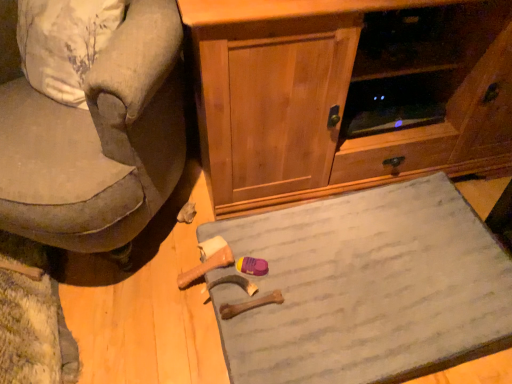
What is the approximate height of velvet gray armchair at left?

velvet gray armchair at left is 29.27 inches in height.

At what (x,y) coordinates should I click in order to perform the action: click on wooden cabinet at center. Please return your answer as a coordinate pair (x, y). Looking at the image, I should click on (348, 94).

Is wooden cabinet at center next to velvet gray armchair at left?

No, wooden cabinet at center is not touching velvet gray armchair at left.

Between point (426, 57) and point (167, 178), which one is positioned behind?

Point (426, 57)

Consider the image. Who is bigger, wooden cabinet at center or velvet gray armchair at left?

wooden cabinet at center.

Find the location of a particular element. This screenshot has width=512, height=384. chair on the left of wooden cabinet at center is located at coordinates click(x=92, y=123).

This screenshot has width=512, height=384. Find the location of `chair lying above the gray fabric doormat at lower center (from the image's perspective)`. chair lying above the gray fabric doormat at lower center (from the image's perspective) is located at coordinates (92, 123).

From the image's perspective, would you say gray fabric doormat at lower center is shown under velvet gray armchair at left?

Yes.

Is gray fabric doormat at lower center placed right next to velvet gray armchair at left?

They are not placed beside each other.

Does velvet gray armchair at left have a lesser width compared to wooden cabinet at center?

Yes.

Is velvet gray armchair at left behind wooden cabinet at center?

No.

How different are the orientations of velvet gray armchair at left and wooden cabinet at center in degrees?

The angle between the facing direction of velvet gray armchair at left and the facing direction of wooden cabinet at center is 54.2 degrees.

Are velvet gray armchair at left and wooden cabinet at center far apart?

No, velvet gray armchair at left is not far away from wooden cabinet at center.

Which of these two, gray fabric doormat at lower center or wooden cabinet at center, is smaller?

With smaller size is gray fabric doormat at lower center.

Considering the relative positions of gray fabric doormat at lower center and wooden cabinet at center in the image provided, is gray fabric doormat at lower center to the left or to the right of wooden cabinet at center?

Based on their positions, gray fabric doormat at lower center is located to the left of wooden cabinet at center.

Is point (441, 224) farther from camera compared to point (307, 190)?

That is False.

Consider the image. Is wooden cabinet at center surrounded by gray fabric doormat at lower center?

Definitely not — wooden cabinet at center is not inside gray fabric doormat at lower center.

In the scene shown: Is wooden cabinet at center facing towards gray fabric doormat at lower center?

No, wooden cabinet at center does not turn towards gray fabric doormat at lower center.

Which is behind, point (255, 123) or point (377, 366)?

Positioned behind is point (255, 123).

From the image's perspective, is velvet gray armchair at left under gray fabric doormat at lower center?

Incorrect, from the image's perspective, velvet gray armchair at left is higher than gray fabric doormat at lower center.

In terms of height, does velvet gray armchair at left look taller or shorter compared to gray fabric doormat at lower center?

In the image, velvet gray armchair at left appears to be taller than gray fabric doormat at lower center.

Locate an element on the screen. The height and width of the screenshot is (384, 512). chair on the left side of gray fabric doormat at lower center is located at coordinates (92, 123).

From a real-world perspective, which is physically below, velvet gray armchair at left or gray fabric doormat at lower center?

gray fabric doormat at lower center, from a real-world perspective.

You are a GUI agent. You are given a task and a screenshot of the screen. Output one action in this format:
    pyautogui.click(x=<x>, y=<y>)
    Task: Click on the chair lying below the wooden cabinet at center (from the image's perspective)
    Image resolution: width=512 pixels, height=384 pixels.
    Given the screenshot: What is the action you would take?
    pyautogui.click(x=92, y=123)

Where is `chair in front of the gray fabric doormat at lower center`? Image resolution: width=512 pixels, height=384 pixels. chair in front of the gray fabric doormat at lower center is located at coordinates (92, 123).

From the image, which object appears to be farther from wooden cabinet at center, gray fabric doormat at lower center or velvet gray armchair at left?

velvet gray armchair at left is positioned further to the anchor wooden cabinet at center.

Looking at the image, which one is located further to gray fabric doormat at lower center, wooden cabinet at center or velvet gray armchair at left?

Based on the image, velvet gray armchair at left appears to be further to gray fabric doormat at lower center.

From the image, which object appears to be farther from gray fabric doormat at lower center, velvet gray armchair at left or wooden cabinet at center?

Based on the image, velvet gray armchair at left appears to be further to gray fabric doormat at lower center.

Considering their positions, is wooden cabinet at center positioned further to velvet gray armchair at left than gray fabric doormat at lower center?

The object further to velvet gray armchair at left is gray fabric doormat at lower center.

From the picture: Based on their spatial positions, is gray fabric doormat at lower center or wooden cabinet at center further from velvet gray armchair at left?

gray fabric doormat at lower center.

Which object lies further to the anchor point wooden cabinet at center, velvet gray armchair at left or gray fabric doormat at lower center?

Based on the image, velvet gray armchair at left appears to be further to wooden cabinet at center.

Locate an element on the screen. The image size is (512, 384). doormat situated between velvet gray armchair at left and wooden cabinet at center from left to right is located at coordinates (367, 288).